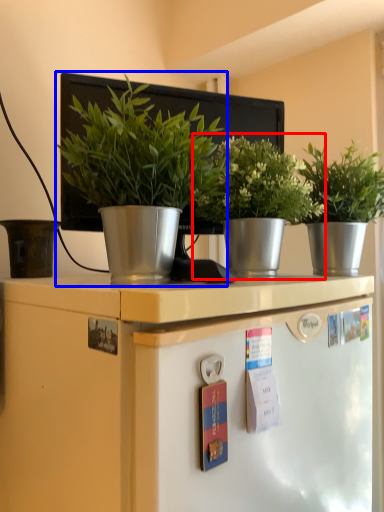
Question: Among these objects, which one is farthest to the camera, houseplant (highlighted by a red box) or houseplant (highlighted by a blue box)?

Choices:
 (A) houseplant
 (B) houseplant

Answer: (A)